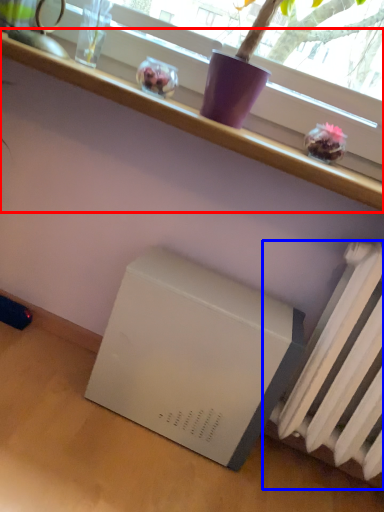
Question: Which object is further to the camera taking this photo, furniture (highlighted by a red box) or radiator (highlighted by a blue box)?

Choices:
 (A) furniture
 (B) radiator

Answer: (A)